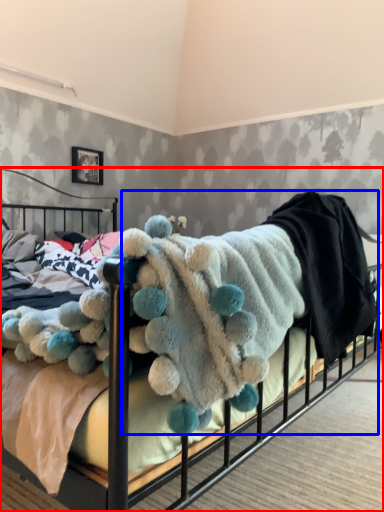
Question: Which object is further to the camera taking this photo, bed (highlighted by a red box) or baby clothe (highlighted by a blue box)?

Choices:
 (A) bed
 (B) baby clothe

Answer: (B)